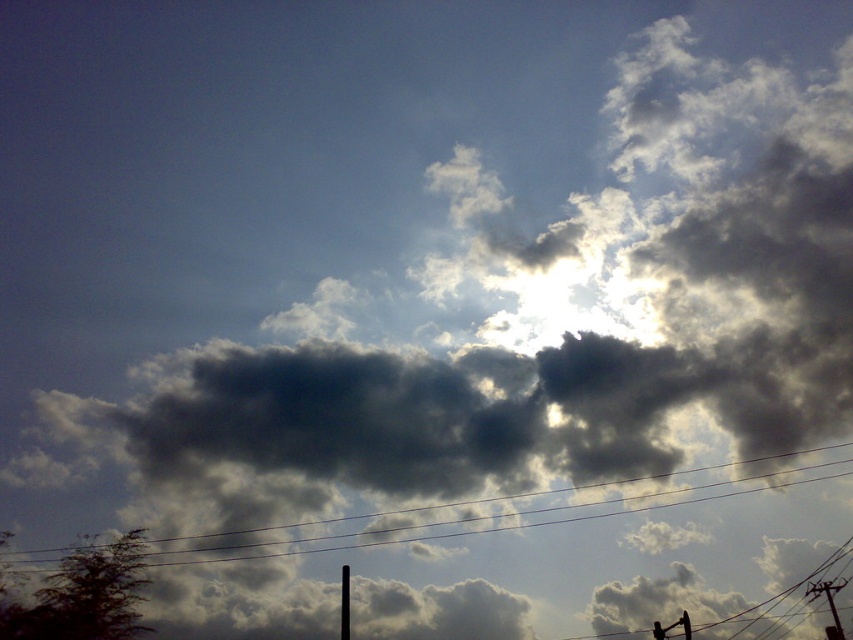
Question: Which object is closer to the camera taking this photo?

Choices:
 (A) black wire at center
 (B) black metallic pole at lower center

Answer: (A)

Question: Which of the following is the farthest from the observer?

Choices:
 (A) (347, 602)
 (B) (505, 515)

Answer: (B)

Question: Can you confirm if black wire at center is positioned to the right of black metallic pole at lower center?

Choices:
 (A) yes
 (B) no

Answer: (A)

Question: Among these points, which one is farthest from the camera?

Choices:
 (A) (178, 538)
 (B) (347, 582)

Answer: (A)

Question: Is black wire at center wider than black metallic pole at lower center?

Choices:
 (A) yes
 (B) no

Answer: (A)

Question: Is black wire at center above black metallic pole at lower center?

Choices:
 (A) yes
 (B) no

Answer: (A)